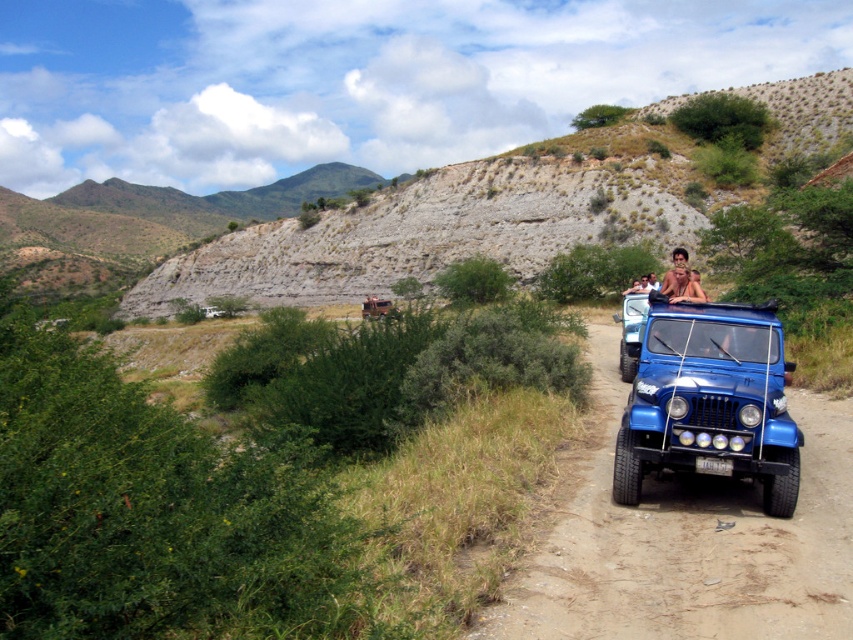
Based on the photo, which of these two, blue matte jeep at center or light brown leather jacket at center, stands taller?

light brown leather jacket at center is taller.

Measure the distance between blue matte jeep at center and light brown leather jacket at center.

blue matte jeep at center and light brown leather jacket at center are 42.20 feet apart from each other.

The image size is (853, 640). Find the location of `blue matte jeep at center`. blue matte jeep at center is located at coordinates (711, 401).

Is blue metallic dirt track at center bigger than blue metallic jeep at center-right?

No, blue metallic dirt track at center is not bigger than blue metallic jeep at center-right.

Does blue metallic dirt track at center have a lesser height compared to blue metallic jeep at center-right?

Yes.

Measure the distance between point (695, 596) and camera.

The distance of point (695, 596) from camera is 18.22 feet.

At what (x,y) coordinates should I click in order to perform the action: click on blue metallic dirt track at center. Please return your answer as a coordinate pair (x, y). Looking at the image, I should click on (688, 541).

Between blue metallic jeep at center-right and brown leather jacket at center, which one is positioned lower?

blue metallic jeep at center-right

The height and width of the screenshot is (640, 853). In order to click on blue metallic jeep at center-right in this screenshot , I will do `click(631, 332)`.

You are a GUI agent. You are given a task and a screenshot of the screen. Output one action in this format:
    pyautogui.click(x=<x>, y=<y>)
    Task: Click on the blue metallic jeep at center-right
    Image resolution: width=853 pixels, height=640 pixels.
    Given the screenshot: What is the action you would take?
    pyautogui.click(x=631, y=332)